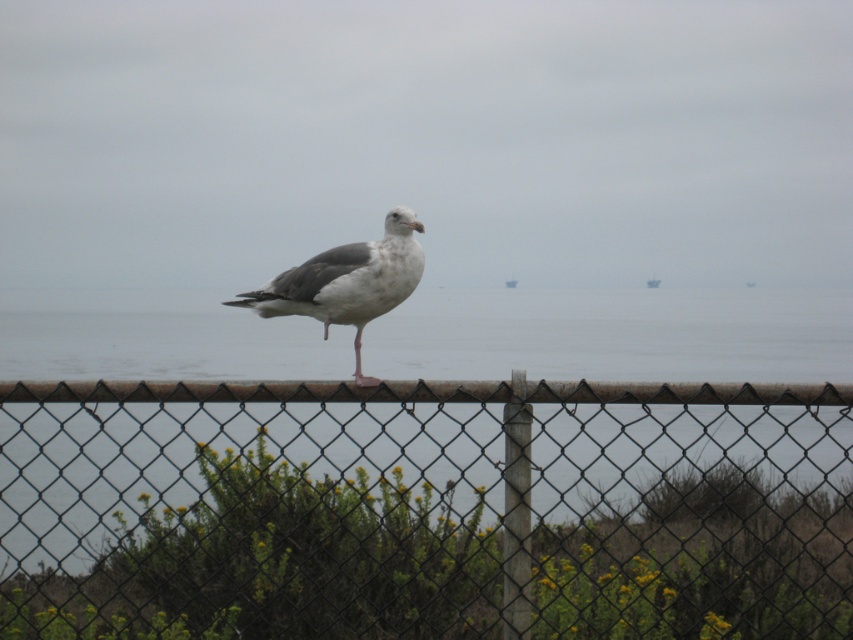
Question: Can you confirm if chain-link fence at center is thinner than white matte bird at center?

Choices:
 (A) no
 (B) yes

Answer: (A)

Question: Is chain-link fence at center wider than white matte bird at center?

Choices:
 (A) yes
 (B) no

Answer: (A)

Question: Does chain-link fence at center appear on the right side of white matte bird at center?

Choices:
 (A) no
 (B) yes

Answer: (B)

Question: Which point is closer to the camera?

Choices:
 (A) chain-link fence at center
 (B) white matte bird at center

Answer: (A)

Question: Among these points, which one is farthest from the camera?

Choices:
 (A) (345, 260)
 (B) (601, 429)

Answer: (A)